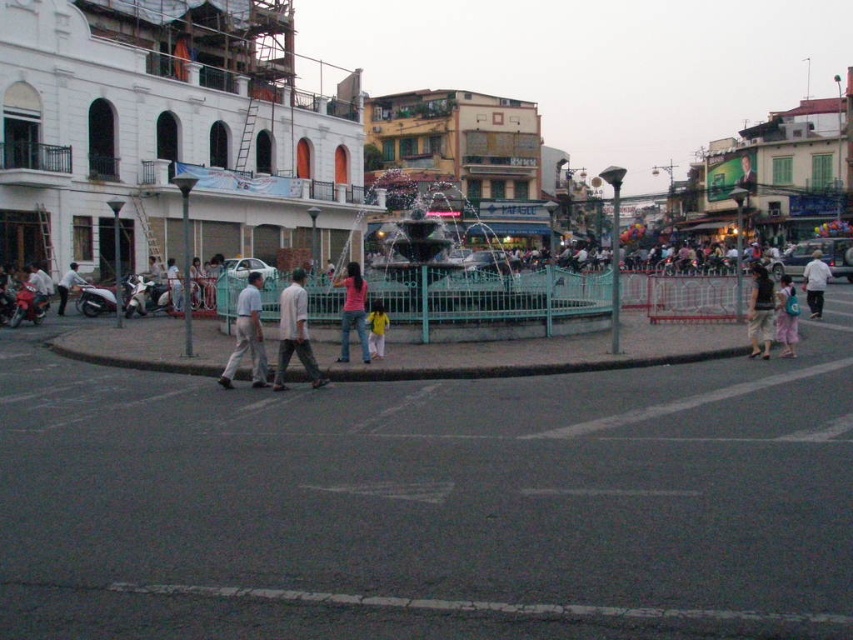
You are standing at the intersection and want to locate the white matte shirt at center. According to the coordinates provided, in which direction should you look relative to your current position?

You should look downward since the y coordinate 0.957 is close to 1, indicating the bottom of the image.

You are standing at the intersection and want to take a photo of the fountain. The two points you are focusing on are point (x=234, y=369) and point (x=776, y=332). Which point should you focus on to ensure it appears larger in your photo?

Point (x=234, y=369) is closer to the camera than point (x=776, y=332), so focusing on point (x=234, y=369) will make it appear larger in the photo.

You are a delivery person trying to cross the street and need to avoid bumping into the white matte shirt at center and the light gray pants at left. Which one should you move around to your right to avoid collision?

Since the white matte shirt at center is in front of the light gray pants at left, you should move around the light gray pants at left to your right to avoid collision.